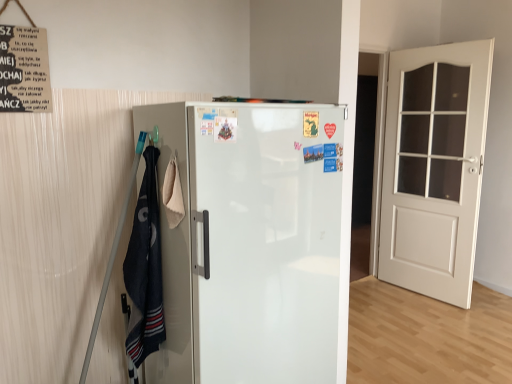
Locate an element on the screen. Image resolution: width=512 pixels, height=384 pixels. free spot below white wood door at right (from a real-world perspective) is located at coordinates (417, 295).